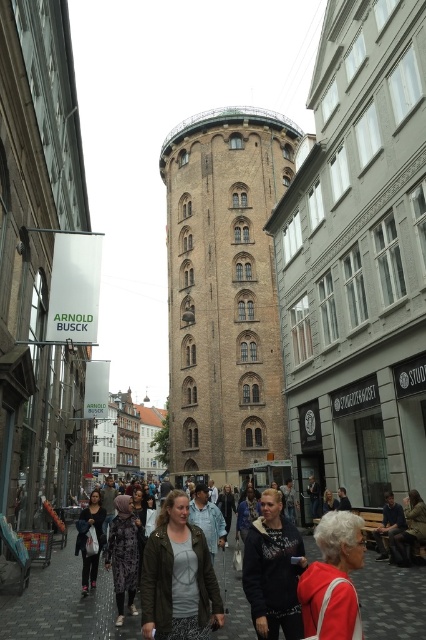
In the urban scene with the historical tower, you see a dark gray hoodie at center and a dark gray fabric jacket at lower center. Which clothing item is positioned more to the right?

The dark gray hoodie at center is positioned more to the right than the dark gray fabric jacket at lower center.

You are a pedestrian standing at the edge of the street. You see the brown brick tower at center and the matte red jacket at lower right. Which object is higher from the ground?

The brown brick tower at center is above matte red jacket at lower right, so the tower is higher from the ground.